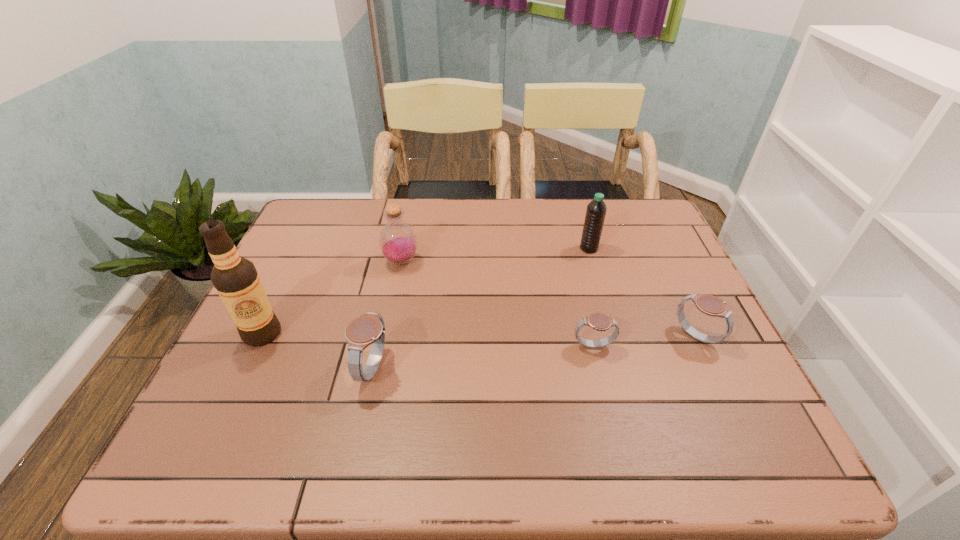
At what (x,y) coordinates should I click in order to perform the action: click on free location located on the back of the tallest watch. Please return your answer as a coordinate pair (x, y). The image size is (960, 540). Looking at the image, I should click on (393, 284).

Locate an element on the screen. vacant space positioned on the back of the second watch from left to right is located at coordinates (574, 268).

I want to click on vacant area located on the back of the second shortest object, so click(650, 239).

You are a GUI agent. You are given a task and a screenshot of the screen. Output one action in this format:
    pyautogui.click(x=<x>, y=<y>)
    Task: Click on the free spot located 0.100m on the right of the bottle
    The width and height of the screenshot is (960, 540).
    Given the screenshot: What is the action you would take?
    pyautogui.click(x=455, y=261)

You are a GUI agent. You are given a task and a screenshot of the screen. Output one action in this format:
    pyautogui.click(x=<x>, y=<y>)
    Task: Click on the vacant space located 0.270m on the left of the water bottle
    The height and width of the screenshot is (540, 960).
    Given the screenshot: What is the action you would take?
    488,248

The image size is (960, 540). Identify the location of free region located on the label of the alcohol. (242, 377).

Identify the location of object at the near edge. The width and height of the screenshot is (960, 540). (369, 329).

You are a GUI agent. You are given a task and a screenshot of the screen. Output one action in this format:
    pyautogui.click(x=<x>, y=<y>)
    Task: Click on the object positioned at the left edge
    
    Given the screenshot: What is the action you would take?
    pyautogui.click(x=235, y=278)

The width and height of the screenshot is (960, 540). I want to click on object that is at the right edge, so click(711, 305).

Locate an element on the screen. The image size is (960, 540). free space at the far edge of the desktop is located at coordinates (438, 238).